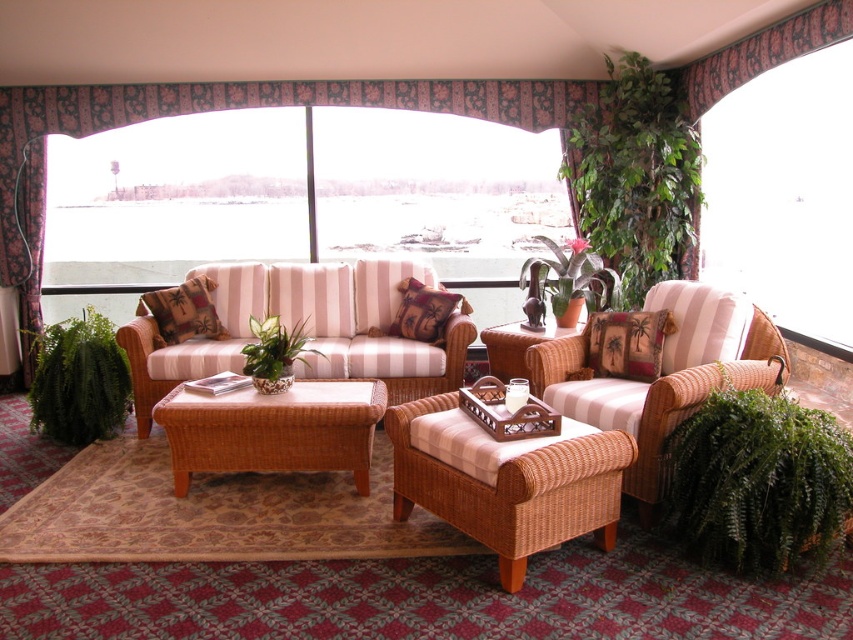
You are sitting on the sofa and want to look outside through the transparent glass window at center. Can you see the pink floral fabric curtain at upper center in your view?

The pink floral fabric curtain at upper center is behind the transparent glass window at center, so when looking through the window, you would see the curtain behind the glass.